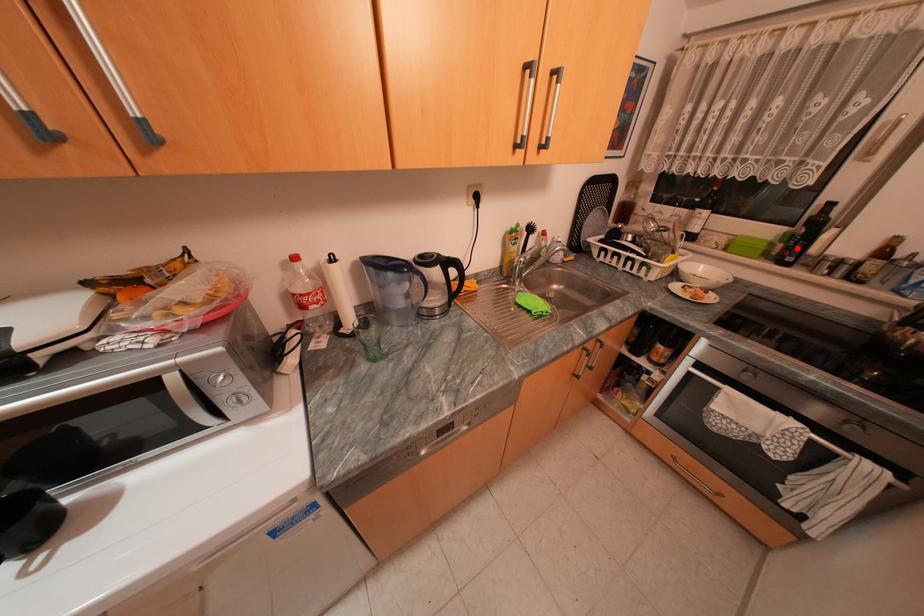
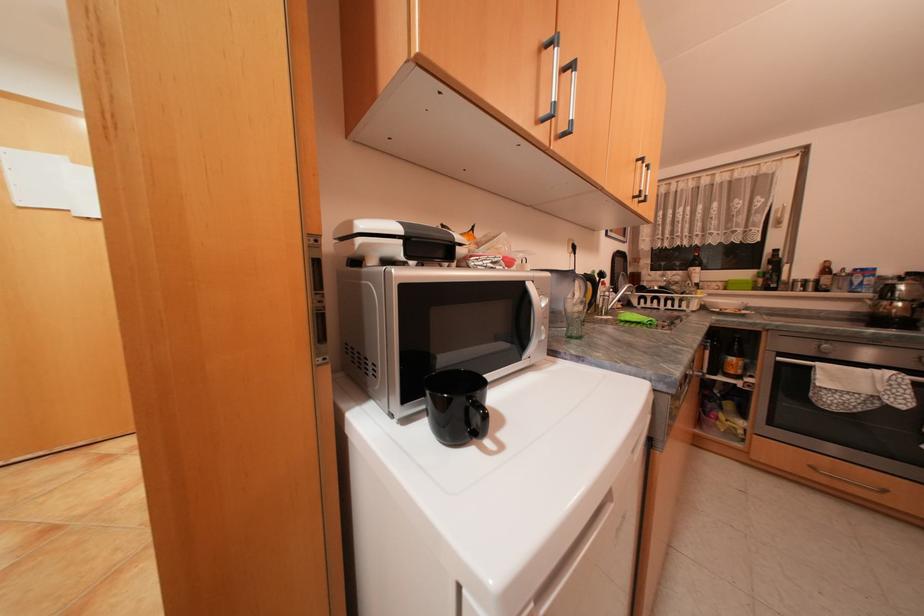
Locate, in the second image, the point that corresponds to the highlighted location in the first image.

(776, 280)